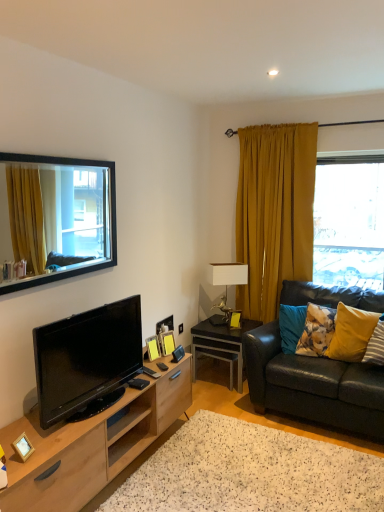
Locate an element on the screen. free location in front of wooden picture frame at lower left, the first picture frame when ordered from front to back is located at coordinates (21, 468).